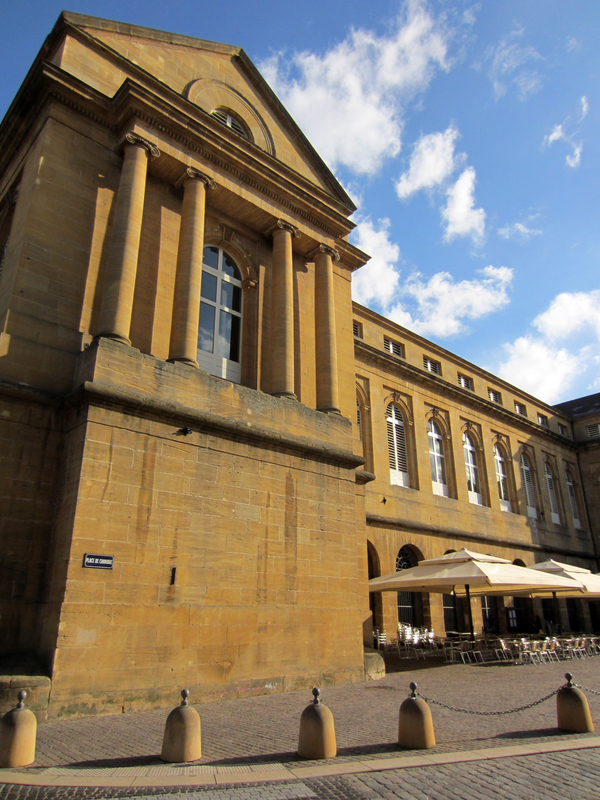
Find the location of a particular element. The image size is (600, 800). window is located at coordinates (228, 341).